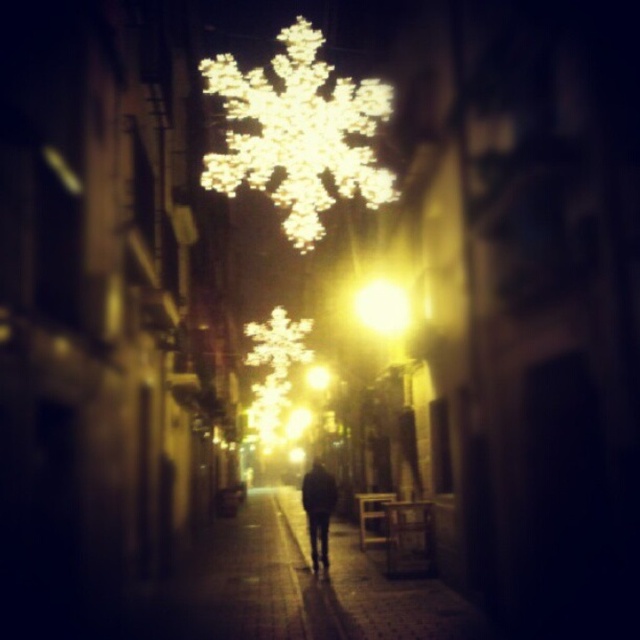
Question: Among these objects, which one is farthest from the camera?

Choices:
 (A) dark gray coat at center
 (B) illuminated plastic snowflake at center
 (C) yellow matte light at center
 (D) smooth stone pavement at center

Answer: (B)

Question: Estimate the real-world distances between objects in this image. Which object is farther from the illuminated plastic snowflake at center?

Choices:
 (A) yellow matte light at center
 (B) dark gray coat at center
 (C) smooth stone pavement at center

Answer: (B)

Question: Is illuminated plastic snowflake at center smaller than dark gray coat at center?

Choices:
 (A) no
 (B) yes

Answer: (A)

Question: Is smooth stone pavement at center above dark gray coat at center?

Choices:
 (A) yes
 (B) no

Answer: (B)

Question: Does illuminated plastic snowflake at center have a greater width compared to dark gray coat at center?

Choices:
 (A) yes
 (B) no

Answer: (A)

Question: Which of the following is the farthest from the observer?

Choices:
 (A) illuminated plastic snowflake at center
 (B) yellow matte light at center
 (C) dark gray coat at center

Answer: (A)